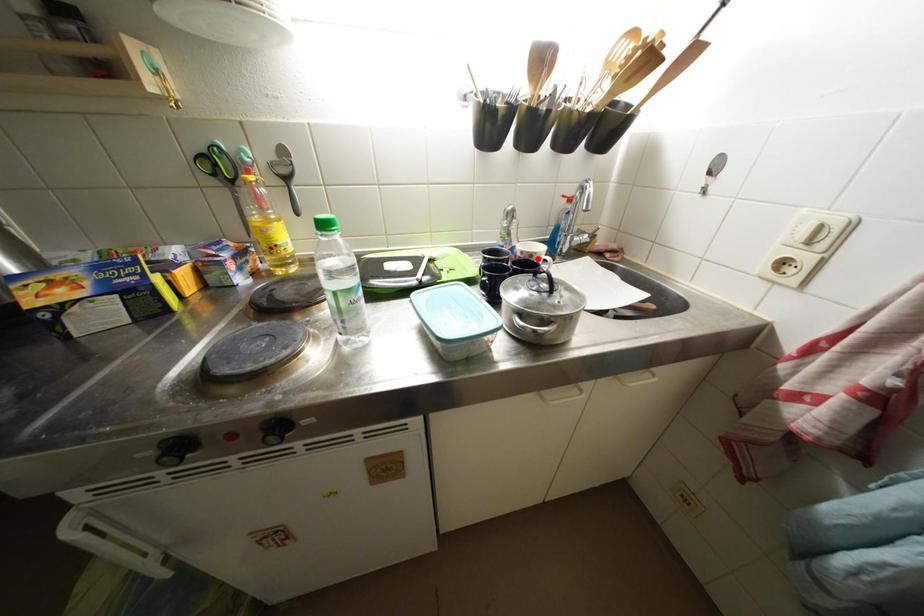
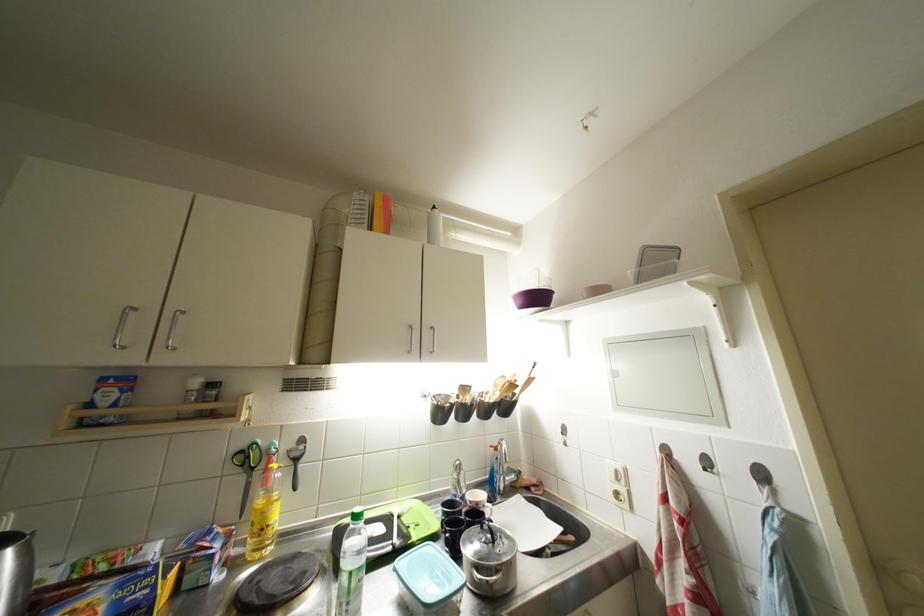
In the second image, find the point that corresponds to the highlighted location in the first image.

(483, 508)